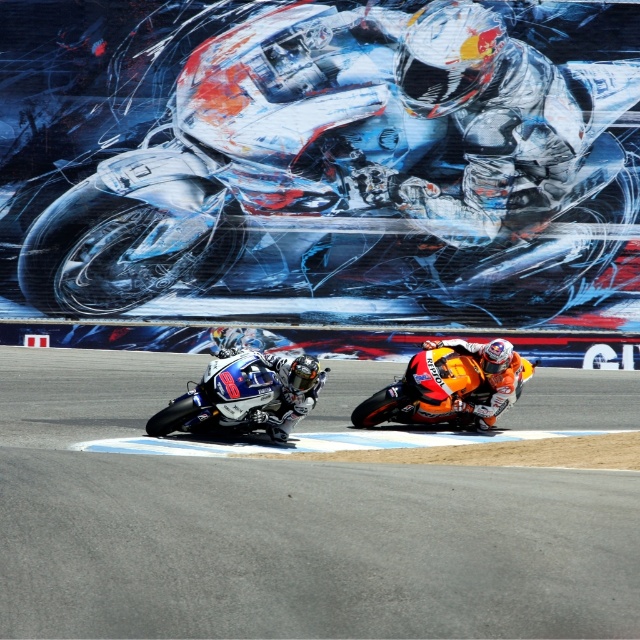
In the scene shown: Can you confirm if smooth asphalt track at center is positioned below shiny metallic motorcycle at lower left?

Indeed, smooth asphalt track at center is positioned under shiny metallic motorcycle at lower left.

Is smooth asphalt track at center taller than shiny metallic motorcycle at lower left?

No, smooth asphalt track at center is not taller than shiny metallic motorcycle at lower left.

Does point (33, 468) come behind point (202, 404)?

No, it is not.

Identify the location of smooth asphalt track at center. (284, 529).

Between shiny metallic motorcycle at upper center and smooth asphalt track at center, which one has less height?

With less height is smooth asphalt track at center.

Is shiny metallic motorcycle at upper center to the left of smooth asphalt track at center from the viewer's perspective?

Yes, shiny metallic motorcycle at upper center is to the left of smooth asphalt track at center.

This screenshot has width=640, height=640. Identify the location of shiny metallic motorcycle at upper center. (321, 161).

Identify the location of shiny metallic motorcycle at upper center. [x=321, y=161].

Is shiny metallic motorcycle at upper center to the right of shiny metallic motorcycle at lower left from the viewer's perspective?

Correct, you'll find shiny metallic motorcycle at upper center to the right of shiny metallic motorcycle at lower left.

Locate an element on the screen. shiny metallic motorcycle at upper center is located at coordinates (321, 161).

Who is more distant from viewer, (42, 64) or (218, 362)?

Point (42, 64)

Find the location of a particular element. The image size is (640, 640). shiny metallic motorcycle at upper center is located at coordinates (321, 161).